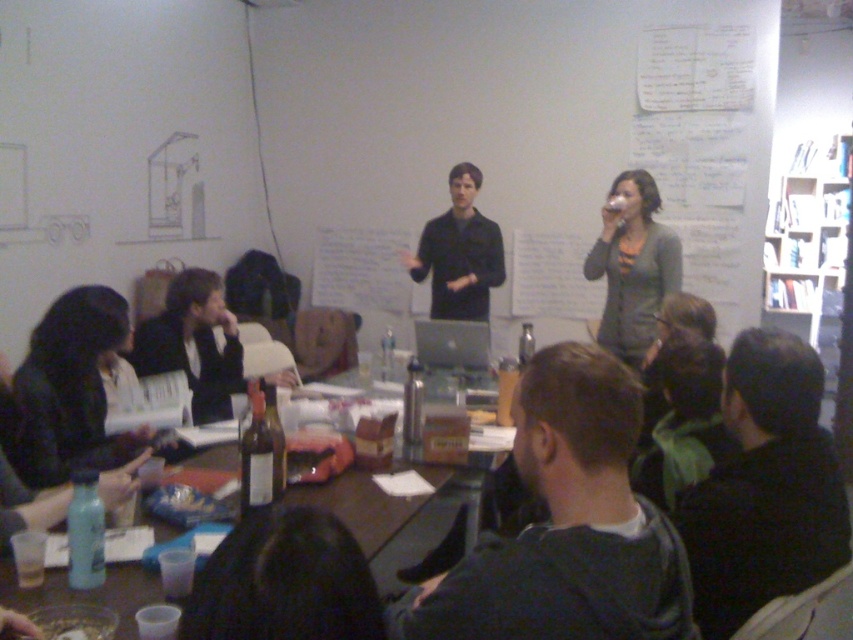
Can you confirm if matte black jacket at lower left is thinner than matte black shirt at center?

Incorrect, matte black jacket at lower left's width is not less than matte black shirt at center's.

Can you confirm if matte black jacket at lower left is positioned above matte black shirt at center?

Actually, matte black jacket at lower left is below matte black shirt at center.

Between point (170, 314) and point (494, 276), which one is positioned behind?

The point (494, 276) is behind.

Find the location of `matte black jacket at lower left`. matte black jacket at lower left is located at coordinates (193, 342).

Is brown wooden table at lower center to the right of matte gray cardigan at upper right from the viewer's perspective?

Incorrect, brown wooden table at lower center is not on the right side of matte gray cardigan at upper right.

From the picture: Who is positioned more to the left, brown wooden table at lower center or matte gray cardigan at upper right?

Positioned to the left is brown wooden table at lower center.

Is point (149, 582) positioned before point (630, 317)?

That is True.

Find the location of a particular element. The image size is (853, 640). brown wooden table at lower center is located at coordinates (393, 515).

Measure the distance between dark wool sweater at lower right and matte gray cardigan at upper right.

dark wool sweater at lower right and matte gray cardigan at upper right are 1.81 meters apart.

Does dark wool sweater at lower right appear on the left side of matte gray cardigan at upper right?

Yes, dark wool sweater at lower right is to the left of matte gray cardigan at upper right.

Is point (701, 481) closer to viewer compared to point (625, 202)?

Yes, point (701, 481) is closer to viewer.

Identify the location of dark wool sweater at lower right. (764, 488).